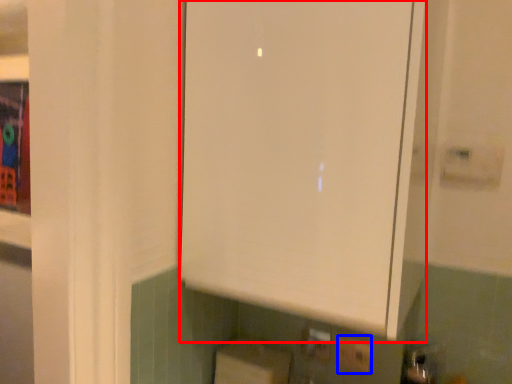
Question: Which point is further to the camera, cabinetry (highlighted by a red box) or electric outlet (highlighted by a blue box)?

Choices:
 (A) cabinetry
 (B) electric outlet

Answer: (B)